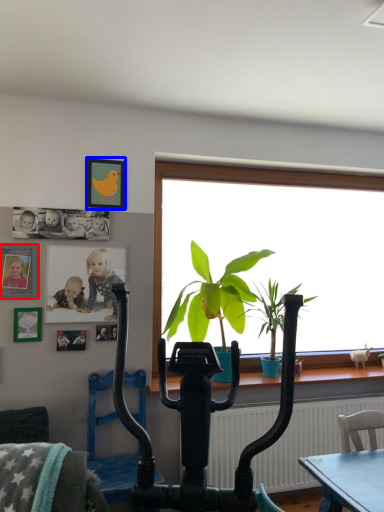
Question: Which point is closer to the camera, picture frame (highlighted by a red box) or picture frame (highlighted by a blue box)?

Choices:
 (A) picture frame
 (B) picture frame

Answer: (A)